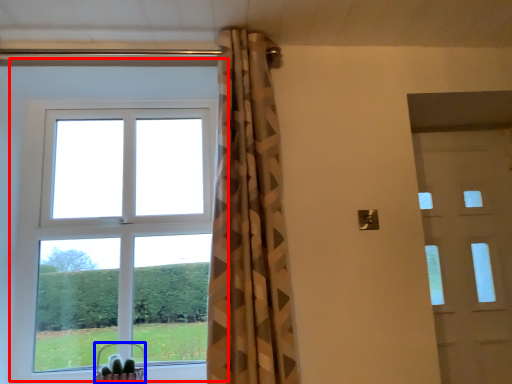
Question: Which point is further to the camera, window (highlighted by a red box) or basket (highlighted by a blue box)?

Choices:
 (A) window
 (B) basket

Answer: (A)